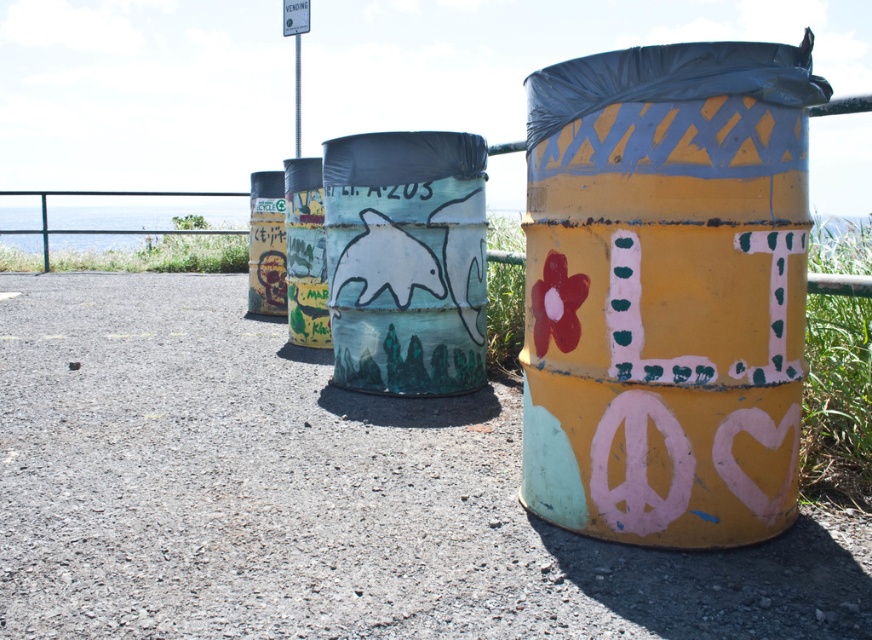
Which is below, yellow matte trash can at right or metallic yellow barrel at center?

yellow matte trash can at right is lower down.

Does yellow matte trash can at right appear over metallic yellow barrel at center?

Actually, yellow matte trash can at right is below metallic yellow barrel at center.

This screenshot has height=640, width=872. What are the coordinates of `yellow matte trash can at right` in the screenshot? It's located at (666, 291).

Can you confirm if matte white dolphin at center is thinner than metallic graffiti can at left?

Incorrect, matte white dolphin at center's width is not less than metallic graffiti can at left's.

Does matte white dolphin at center have a greater width compared to metallic graffiti can at left?

Indeed, matte white dolphin at center has a greater width compared to metallic graffiti can at left.

Is point (346, 164) closer to camera compared to point (271, 278)?

Yes, it is in front of point (271, 278).

You are a GUI agent. You are given a task and a screenshot of the screen. Output one action in this format:
    pyautogui.click(x=<x>, y=<y>)
    Task: Click on the matte white dolphin at center
    The width and height of the screenshot is (872, 640).
    Given the screenshot: What is the action you would take?
    pyautogui.click(x=406, y=260)

Does point (792, 129) lie in front of point (273, 198)?

Yes, it is in front of point (273, 198).

This screenshot has height=640, width=872. In order to click on yellow matte trash can at right in this screenshot , I will do `click(666, 291)`.